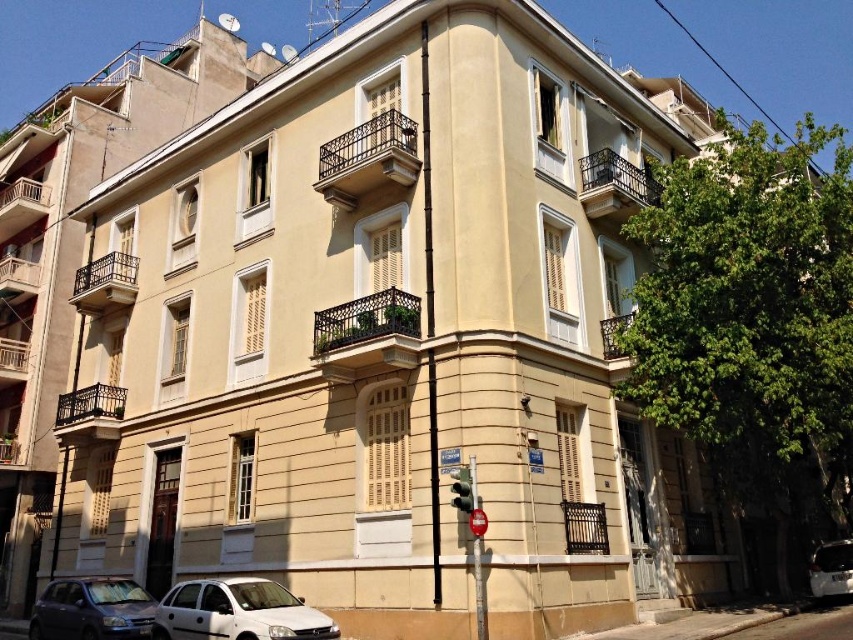
Question: Is metallic gray car at lower left above green glass traffic light at lower center?

Choices:
 (A) yes
 (B) no

Answer: (B)

Question: Is white matte car at lower center to the left of green glass traffic light at lower center from the viewer's perspective?

Choices:
 (A) no
 (B) yes

Answer: (B)

Question: Considering the real-world distances, which object is closest to the white glossy car at lower right?

Choices:
 (A) green glass traffic light at lower center
 (B) metallic gray car at lower left

Answer: (A)

Question: In this image, where is white glossy car at lower right located relative to green glass traffic light at lower center?

Choices:
 (A) below
 (B) above

Answer: (A)

Question: Which point is closer to the camera?

Choices:
 (A) white glossy car at lower right
 (B) white matte car at lower center
 (C) metallic gray car at lower left
 (D) green glass traffic light at lower center

Answer: (B)

Question: Which point is farther to the camera?

Choices:
 (A) white glossy car at lower right
 (B) metallic gray car at lower left
 (C) white matte car at lower center
 (D) green glass traffic light at lower center

Answer: (A)